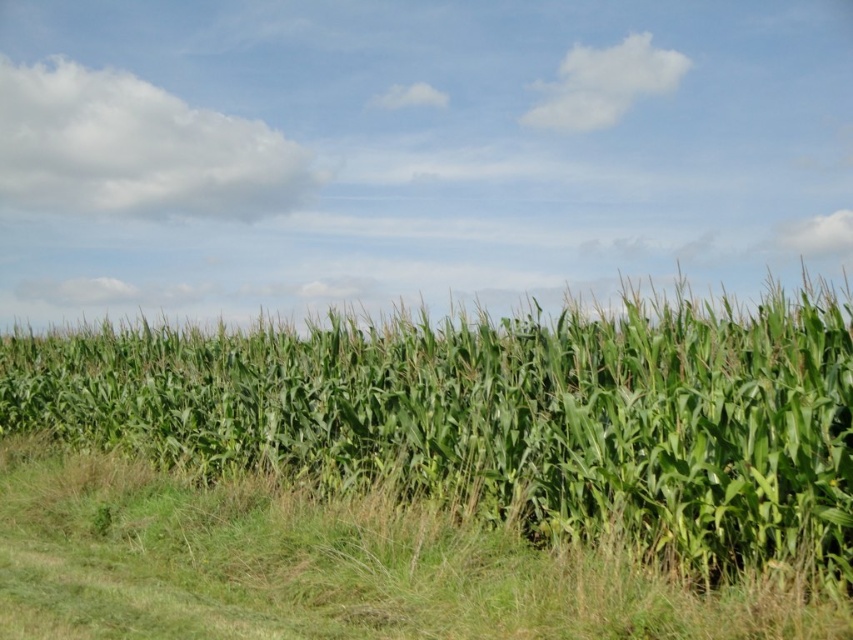
Between point (430, 406) and point (62, 566), which one is positioned behind?

The point (430, 406) is more distant.

Is green leafy corn at center to the left of green grass at lower center from the viewer's perspective?

Correct, you'll find green leafy corn at center to the left of green grass at lower center.

Where is `green leafy corn at center`? Image resolution: width=853 pixels, height=640 pixels. green leafy corn at center is located at coordinates (502, 417).

The image size is (853, 640). What are the coordinates of `green leafy corn at center` in the screenshot? It's located at (502, 417).